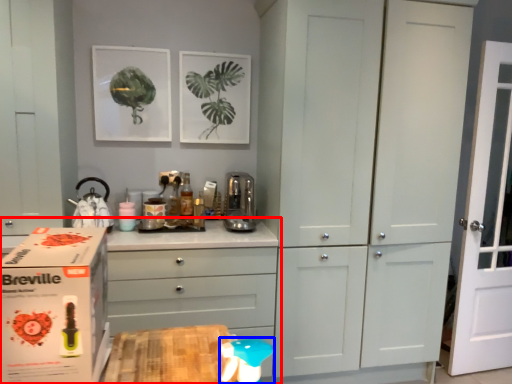
Question: Which object appears farthest to the camera in this image, chest of drawers (highlighted by a red box) or toy (highlighted by a blue box)?

Choices:
 (A) chest of drawers
 (B) toy

Answer: (A)